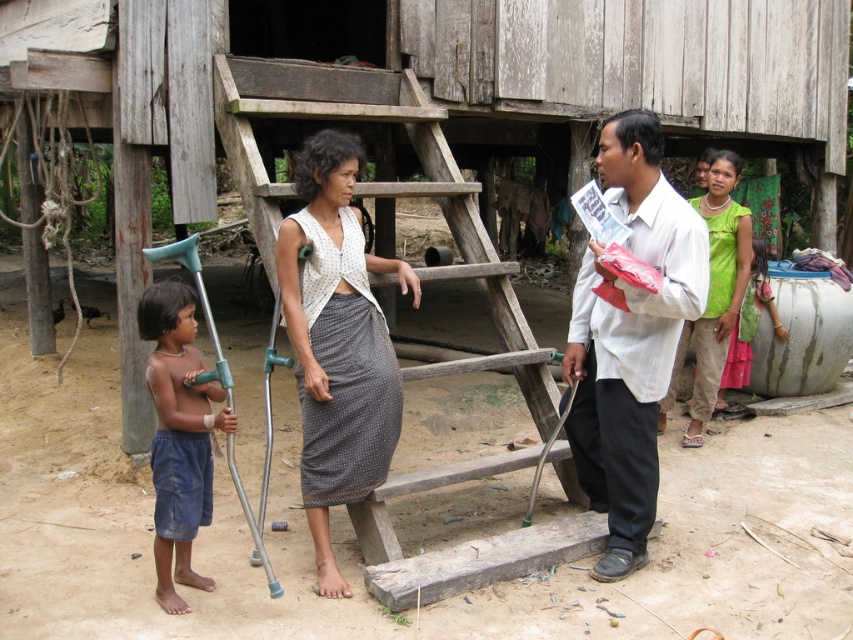
From the picture: Does blue denim shorts at lower left lie in front of green fabric top at upper right?

Yes, blue denim shorts at lower left is in front of green fabric top at upper right.

Does point (187, 372) lie in front of point (706, 362)?

Yes, it is.

At what (x,y) coordinates should I click in order to perform the action: click on blue denim shorts at lower left. Please return your answer as a coordinate pair (x, y). This screenshot has height=640, width=853. Looking at the image, I should click on (178, 436).

Who is positioned more to the right, wooden at center or blue denim shorts at lower left?

Positioned to the right is wooden at center.

Does wooden at center appear on the right side of blue denim shorts at lower left?

Correct, you'll find wooden at center to the right of blue denim shorts at lower left.

What do you see at coordinates (474, 275) in the screenshot? The height and width of the screenshot is (640, 853). I see `wooden at center` at bounding box center [474, 275].

Locate an element on the screen. The height and width of the screenshot is (640, 853). wooden at center is located at coordinates click(474, 275).

Is white knitted vest at center taller than blue denim shorts at lower left?

Correct, white knitted vest at center is much taller as blue denim shorts at lower left.

Does white knitted vest at center have a lesser height compared to blue denim shorts at lower left?

No, white knitted vest at center is not shorter than blue denim shorts at lower left.

Does point (387, 266) lie in front of point (183, 468)?

No, (387, 266) is behind (183, 468).

What are the coordinates of `white knitted vest at center` in the screenshot? It's located at (337, 340).